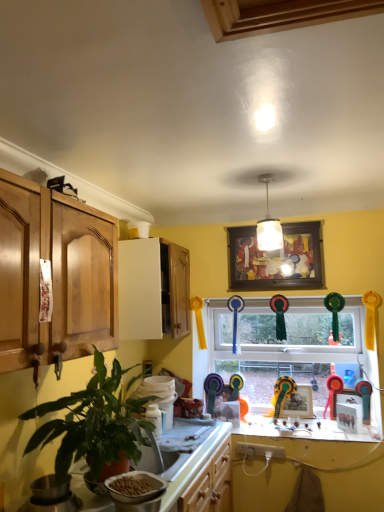
Question: Is wooden framed artwork at center, placed as the 1th picture frame when sorted from front to back, to the left of metallic gold trophy at window from the viewer's perspective?

Choices:
 (A) no
 (B) yes

Answer: (B)

Question: Could you tell me if wooden framed artwork at center, placed as the 1th picture frame when sorted from front to back, is facing metallic gold trophy at window?

Choices:
 (A) yes
 (B) no

Answer: (B)

Question: Does wooden framed artwork at center, acting as the first picture frame starting from the top, have a smaller size compared to metallic gold trophy at window?

Choices:
 (A) no
 (B) yes

Answer: (A)

Question: Would you say metallic gold trophy at window is part of wooden framed artwork at center, placed as the 1th picture frame when sorted from front to back,'s contents?

Choices:
 (A) yes
 (B) no

Answer: (B)

Question: Considering the relative sizes of wooden framed artwork at center, placed as the 1th picture frame when sorted from front to back, and metallic gold trophy at window in the image provided, is wooden framed artwork at center, placed as the 1th picture frame when sorted from front to back, thinner than metallic gold trophy at window?

Choices:
 (A) yes
 (B) no

Answer: (A)

Question: From a real-world perspective, is green leafy plant at left above or below white plastic bowl at lower center?

Choices:
 (A) above
 (B) below

Answer: (A)

Question: Considering the positions of green leafy plant at left and white plastic bowl at lower center in the image, is green leafy plant at left wider or thinner than white plastic bowl at lower center?

Choices:
 (A) wide
 (B) thin

Answer: (A)

Question: In the image, is green leafy plant at left positioned in front of or behind white plastic bowl at lower center?

Choices:
 (A) front
 (B) behind

Answer: (A)

Question: Considering the positions of point (117, 439) and point (162, 487), is point (117, 439) closer or farther from the camera than point (162, 487)?

Choices:
 (A) closer
 (B) farther

Answer: (A)

Question: Is metallic gold trophy at window wider or thinner than glass window at center?

Choices:
 (A) wide
 (B) thin

Answer: (A)

Question: Would you say metallic gold trophy at window is inside or outside glass window at center?

Choices:
 (A) outside
 (B) inside

Answer: (B)

Question: From their relative heights in the image, would you say metallic gold trophy at window is taller or shorter than glass window at center?

Choices:
 (A) tall
 (B) short

Answer: (B)

Question: Is point (281, 400) closer or farther from the camera than point (297, 321)?

Choices:
 (A) closer
 (B) farther

Answer: (A)

Question: Looking at the image, does matte wooden picture frame at center, acting as the second picture frame starting from the top, seem bigger or smaller compared to green leafy plant at left?

Choices:
 (A) big
 (B) small

Answer: (B)

Question: From the image's perspective, is matte wooden picture frame at center, marked as the 1th picture frame in a back-to-front arrangement, above or below green leafy plant at left?

Choices:
 (A) below
 (B) above

Answer: (A)